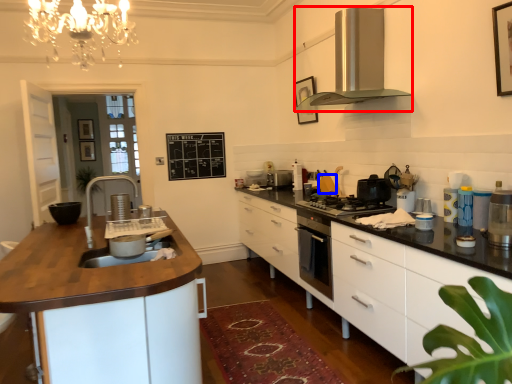
Question: Which object appears closest to the camera in this image, home appliance (highlighted by a red box) or appliance (highlighted by a blue box)?

Choices:
 (A) home appliance
 (B) appliance

Answer: (A)